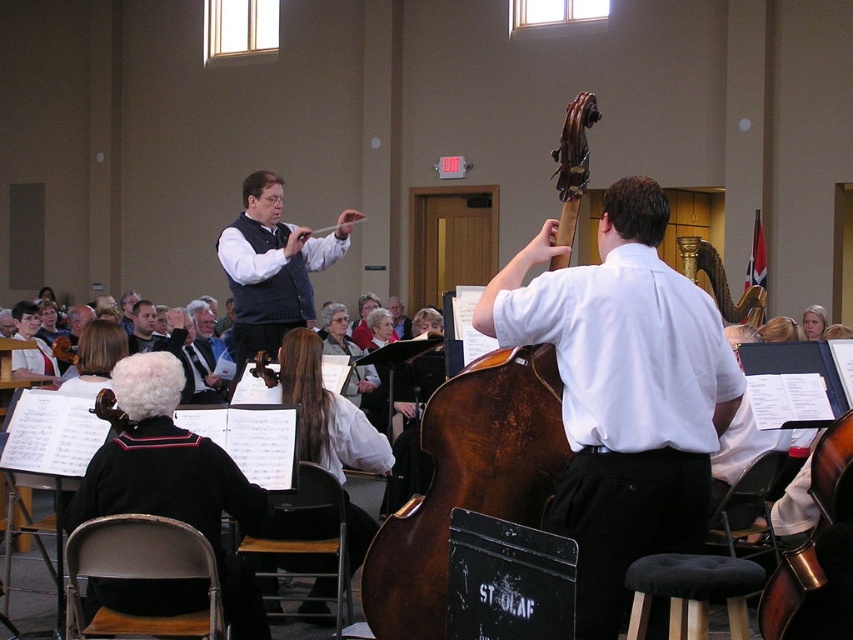
Question: Is matte black vest at center further to camera compared to dark brown fabric stool at lower center?

Choices:
 (A) no
 (B) yes

Answer: (B)

Question: Can you confirm if dark brown wood cello at center is positioned to the left of white fabric coat at center?

Choices:
 (A) yes
 (B) no

Answer: (B)

Question: Among these points, which one is nearest to the camera?

Choices:
 (A) (450, 458)
 (B) (590, 387)
 (C) (273, 602)

Answer: (B)

Question: Does white shirt at center appear on the right side of dark brown fabric stool at lower center?

Choices:
 (A) no
 (B) yes

Answer: (A)

Question: Based on their relative distances, which object is farther from the matte black vest at center?

Choices:
 (A) dark brown polished wood cello at lower right
 (B) white fabric coat at center
 (C) white shirt at center
 (D) dark brown wood cello at center

Answer: (A)

Question: Estimate the real-world distances between objects in this image. Which object is farther from the dark brown fabric stool at lower center?

Choices:
 (A) dark brown wood cello at center
 (B) dark brown polished wood cello at lower right
 (C) white fabric coat at center
 (D) matte black vest at center

Answer: (D)